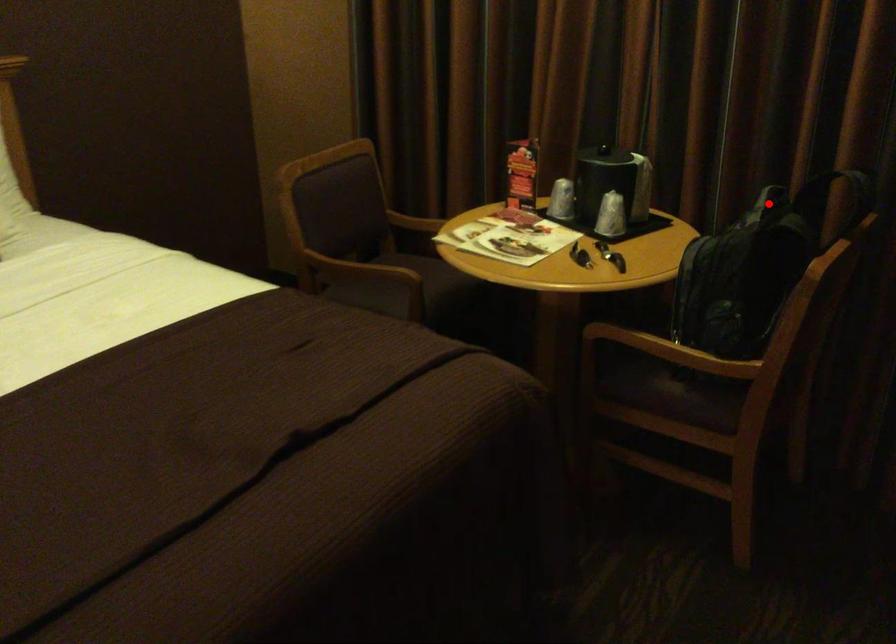
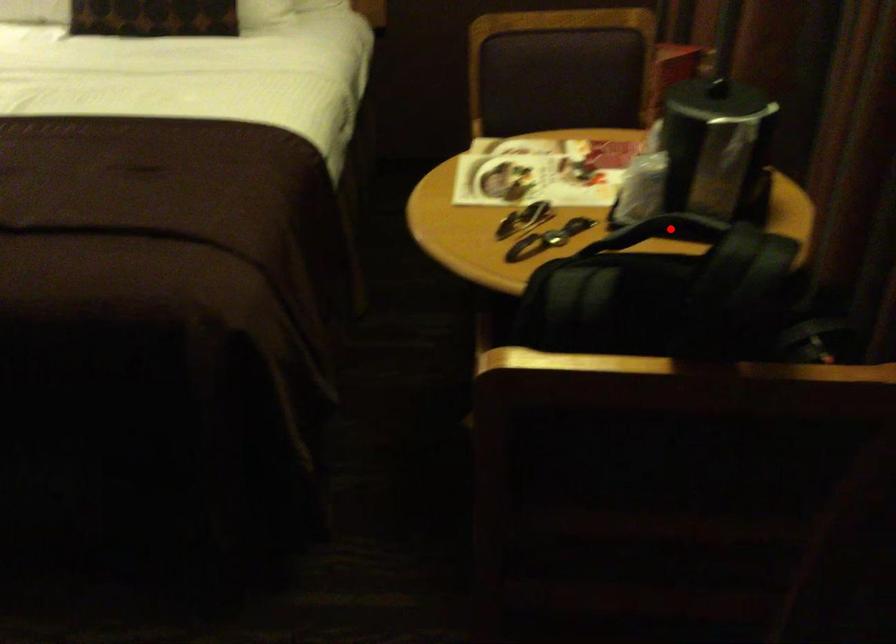
I am providing you with two images of the same scene from different viewpoints. A red point is marked on the first image and another point is marked on the second image. Are the points marked in image1 and image2 representing the same 3D position?

Yes